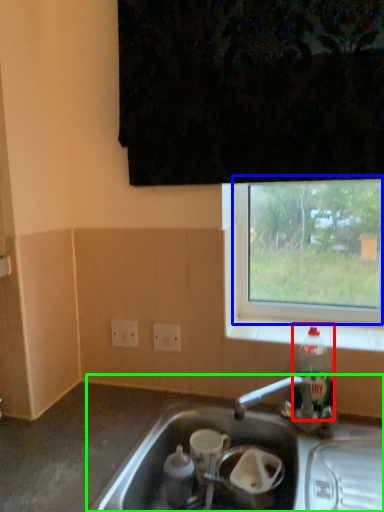
Question: Considering the real-world distances, which object is closest to bottle (highlighted by a red box)? window (highlighted by a blue box) or sink (highlighted by a green box).

Choices:
 (A) window
 (B) sink

Answer: (B)